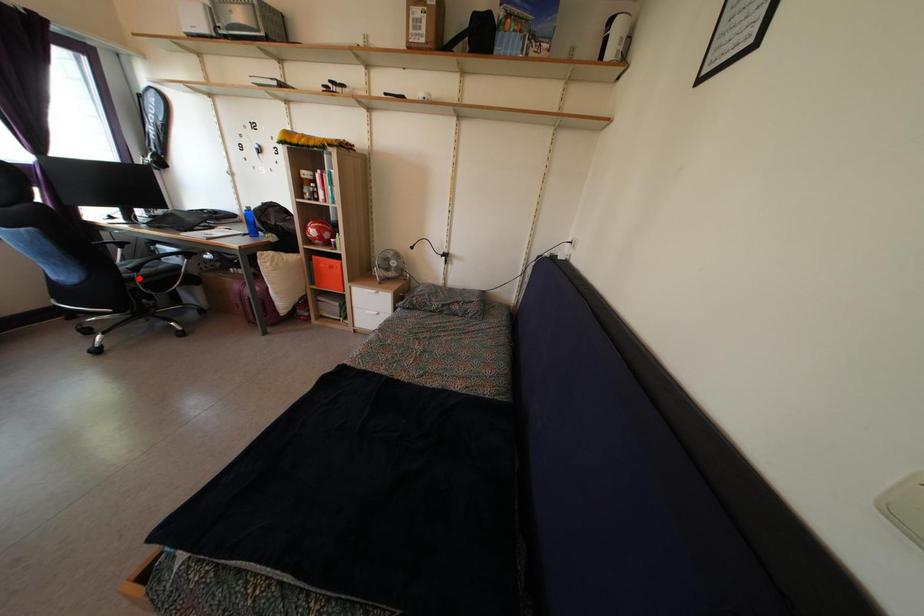
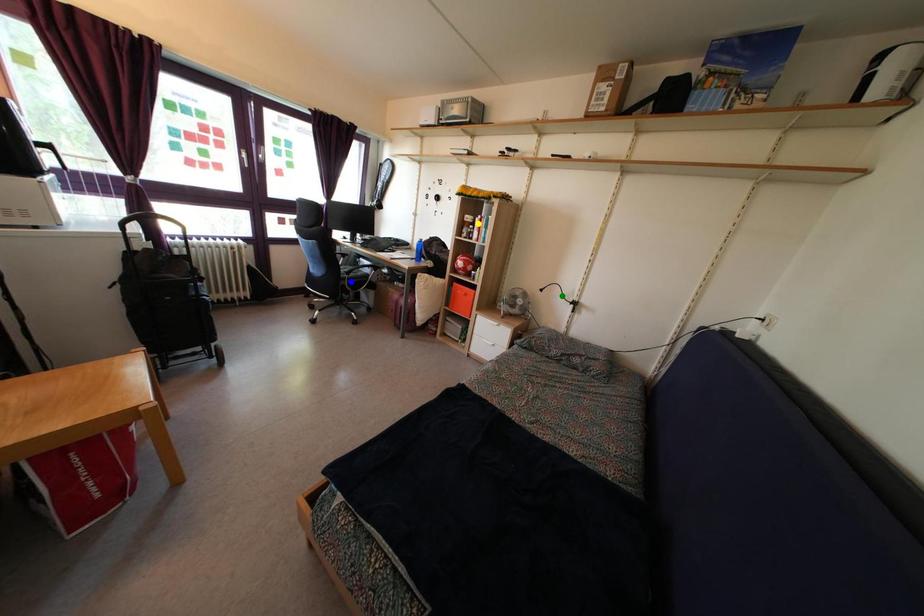
Question: I am providing you with two images of the same scene from different viewpoints. A red point is marked on the first image. You are given multiple points on the second image. Which spot in image 2 lines up with the point in image 1?

Choices:
 (A) blue point
 (B) green point
 (C) yellow point

Answer: (A)